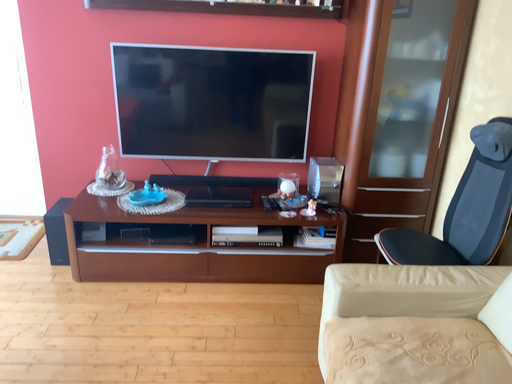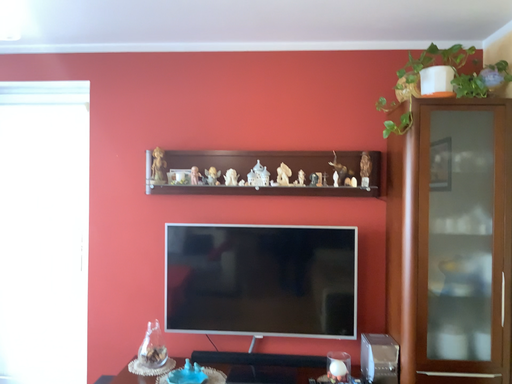
Question: Which way did the camera rotate in the video?

Choices:
 (A) rotated right
 (B) rotated left

Answer: (B)